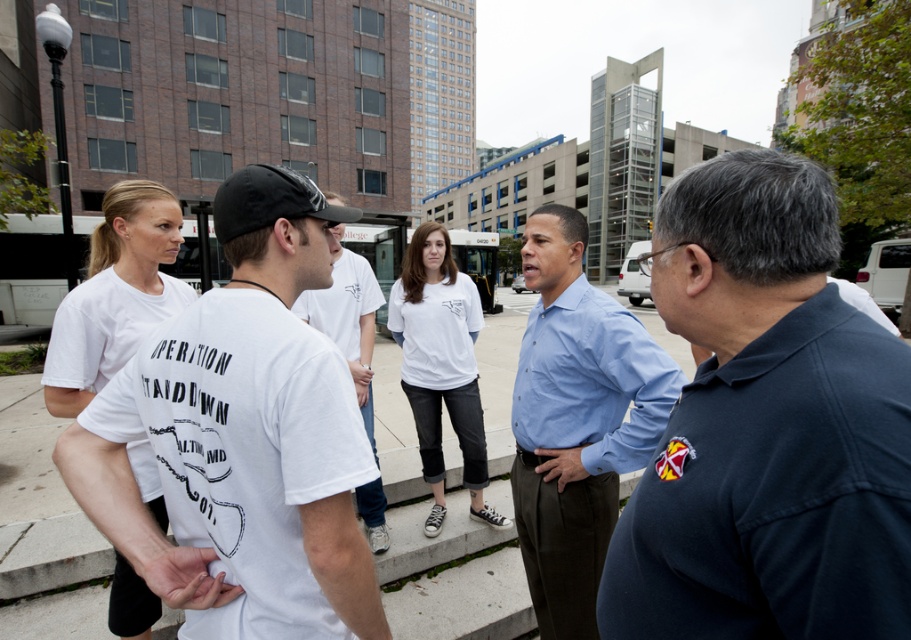
Question: Considering the relative positions of light blue shirt at center and white cotton t-shirt at upper left in the image provided, where is light blue shirt at center located with respect to white cotton t-shirt at upper left?

Choices:
 (A) below
 (B) above

Answer: (A)

Question: Can you confirm if light blue shirt at center is positioned to the right of white cotton t-shirt at center?

Choices:
 (A) no
 (B) yes

Answer: (B)

Question: Which of the following is the closest to the observer?

Choices:
 (A) white cotton shirt at center
 (B) dark blue polo shirt at center
 (C) white cotton t-shirt at upper left
 (D) white cotton t-shirt at center

Answer: (B)

Question: Which of the following is the closest to the observer?

Choices:
 (A) white matte t-shirt at center
 (B) light blue shirt at center

Answer: (A)

Question: Observing the image, what is the correct spatial positioning of concrete pavement at center in reference to white cotton t-shirt at upper left?

Choices:
 (A) below
 (B) above

Answer: (A)

Question: Which point is farther to the camera?

Choices:
 (A) (149, 224)
 (B) (182, 333)

Answer: (A)